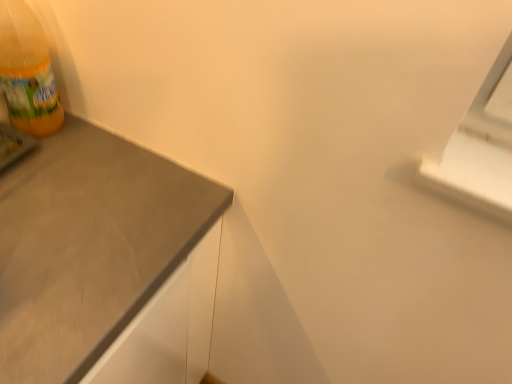
Question: Should I look upward or downward to see translucent yellow bottle at left?

Choices:
 (A) down
 (B) up

Answer: (B)